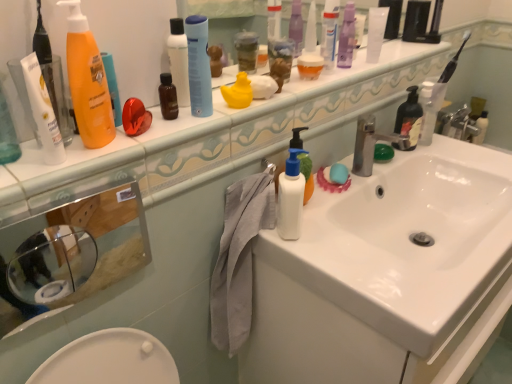
Question: Based on their positions, is translucent plastic container at upper center, which appears as the 3th toiletry when viewed from the front, located to the left or right of silver metallic faucet at sink right?

Choices:
 (A) right
 (B) left

Answer: (B)

Question: Is translucent plastic container at upper center, which is the third toiletry from left to right, bigger or smaller than silver metallic faucet at sink right?

Choices:
 (A) small
 (B) big

Answer: (A)

Question: Estimate the real-world distances between objects in this image. Which object is closer to the white glossy sink at center?

Choices:
 (A) silver metallic faucet at sink right
 (B) blue matte spray can at upper center, which ranks as the second cleaning product in front-to-back order
 (C) silver metallic faucet at upper right
 (D) translucent plastic bottle at upper right, arranged as the 3th cleaning product when viewed from the left
 (E) matte brown soap at center, arranged as the sixth toiletry when viewed from the back

Answer: (A)

Question: Based on their relative distances, which object is farther from the matte white tube at upper left, which ranks as the 1th toiletry in left-to-right order?

Choices:
 (A) translucent plastic container at upper center, which is counted as the 5th toiletry, starting from the back
 (B) matte brown soap at center, arranged as the sixth toiletry when viewed from the back
 (C) white matte plastic bottle at center
 (D) blue matte spray can at upper center, which ranks as the second cleaning product in front-to-back order
 (E) black matte soap dispenser at right, the sixth toiletry in the left-to-right sequence

Answer: (E)